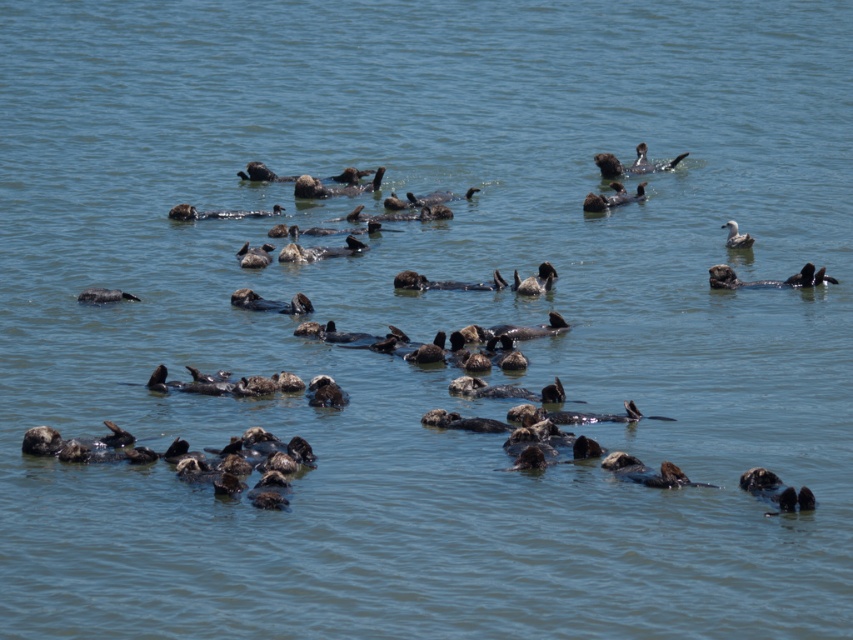
You are a photographer trying to capture a clear shot of the dark brown fur seal at right and the white fluffy duck at upper right. Which animal will appear closer to the camera in your photo?

The dark brown fur seal at right will appear closer to the camera because it is in front of the white fluffy duck at upper right.

You are standing at the point labeled as point (810, 262). You want to throw a small pebble to reach the viewer who is 40.33 meters away. If the pebble travels in a straight line, will it pass over the sea otters floating in the water?

The point labeled as point (810, 262) is 40.33 meters away from the viewer. Since the pebble is thrown in a straight line towards the viewer, it will travel directly towards them and pass over the sea otters floating in the water.

You are observing the sea otters in the bay. There are two points in the water labeled as point [711,273] and point [733,241]. Which point is closer to you?

Point [711,273] is closer to the viewer than point [733,241].